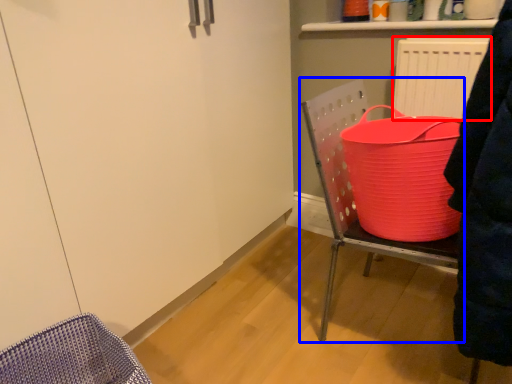
Question: Which of the following is the closest to the observer, radiator (highlighted by a red box) or furniture (highlighted by a blue box)?

Choices:
 (A) radiator
 (B) furniture

Answer: (B)